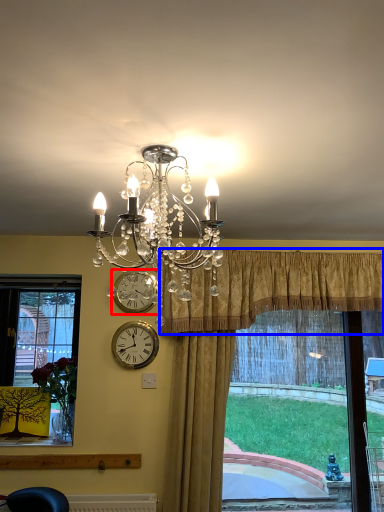
Question: Which object appears farthest to the camera in this image, clock (highlighted by a red box) or curtain (highlighted by a blue box)?

Choices:
 (A) clock
 (B) curtain

Answer: (A)